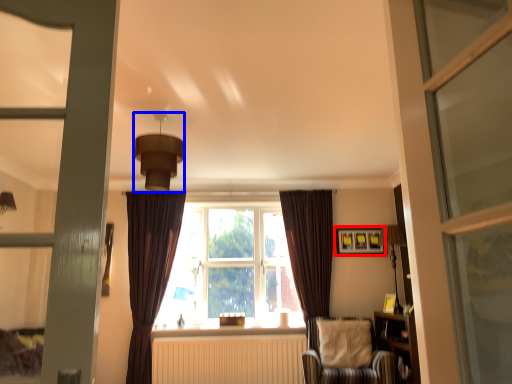
Question: Which point is closer to the camera, picture frame (highlighted by a red box) or light fixture (highlighted by a blue box)?

Choices:
 (A) picture frame
 (B) light fixture

Answer: (B)